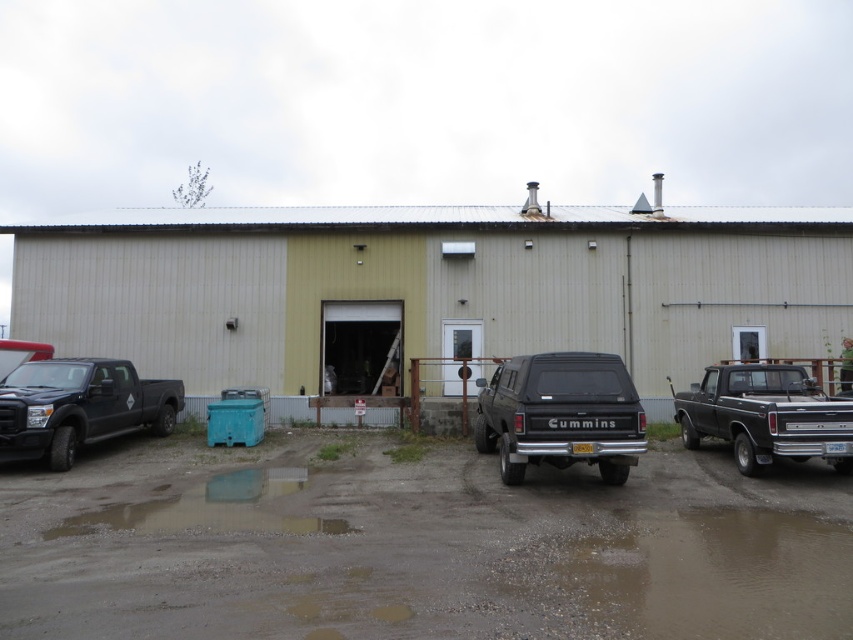
Which of these two, matte black truck at left or black matte truck at right, stands shorter?

With less height is black matte truck at right.

Can you confirm if matte black truck at left is positioned to the left of black matte truck at right?

Yes, matte black truck at left is to the left of black matte truck at right.

Who is more forward, (59, 401) or (793, 396)?

Point (59, 401) is more forward.

At what (x,y) coordinates should I click in order to perform the action: click on matte black truck at left. Please return your answer as a coordinate pair (x, y). This screenshot has height=640, width=853. Looking at the image, I should click on (79, 406).

Does black matte truck at center have a smaller size compared to matte black truck at left?

No, black matte truck at center is not smaller than matte black truck at left.

Which is below, black matte truck at center or matte black truck at left?

matte black truck at left

Where is `black matte truck at center`? Image resolution: width=853 pixels, height=640 pixels. black matte truck at center is located at coordinates (560, 413).

This screenshot has width=853, height=640. Find the location of `black matte truck at center`. black matte truck at center is located at coordinates (560, 413).

Which of these two, brown textured mud at lower center or black matte truck at center, stands shorter?

brown textured mud at lower center

You are a GUI agent. You are given a task and a screenshot of the screen. Output one action in this format:
    pyautogui.click(x=<x>, y=<y>)
    Task: Click on the brown textured mud at lower center
    Image resolution: width=853 pixels, height=640 pixels.
    Given the screenshot: What is the action you would take?
    pyautogui.click(x=416, y=547)

Locate an element on the screen. This screenshot has height=640, width=853. brown textured mud at lower center is located at coordinates (416, 547).